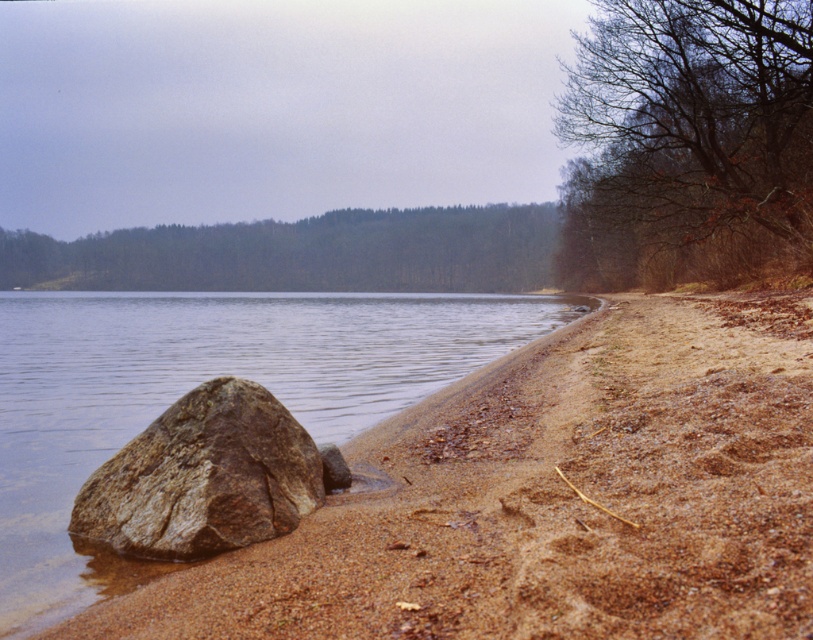
Does clear water at shore left appear on the left side of brown rough rock at lower left?

Indeed, clear water at shore left is positioned on the left side of brown rough rock at lower left.

Identify the location of clear water at shore left. The height and width of the screenshot is (640, 813). (193, 387).

Image resolution: width=813 pixels, height=640 pixels. In order to click on clear water at shore left in this screenshot , I will do `click(193, 387)`.

Can you confirm if clear water at shore left is thinner than green leafy forest at upper center?

Yes.

Does point (266, 376) come in front of point (90, 253)?

That is True.

Does point (429, 324) come farther from viewer compared to point (138, 264)?

That is False.

The height and width of the screenshot is (640, 813). In order to click on clear water at shore left in this screenshot , I will do `click(193, 387)`.

Who is positioned more to the left, brown leafy tree at upper right or brown rough rock at lower left?

Positioned to the left is brown rough rock at lower left.

Between brown leafy tree at upper right and brown rough rock at lower left, which one is positioned lower?

brown rough rock at lower left is below.

What do you see at coordinates (688, 145) in the screenshot?
I see `brown leafy tree at upper right` at bounding box center [688, 145].

Where is `brown leafy tree at upper right`? brown leafy tree at upper right is located at coordinates (688, 145).